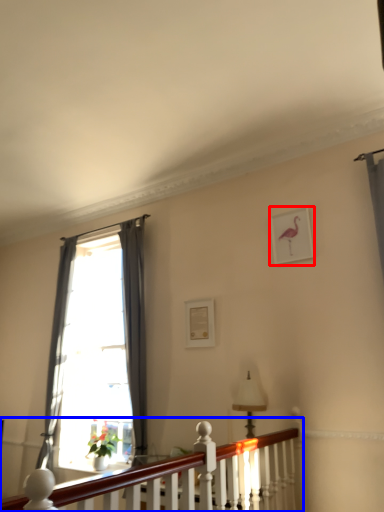
Question: Among these objects, which one is nearest to the camera, picture frame (highlighted by a red box) or balustrade (highlighted by a blue box)?

Choices:
 (A) picture frame
 (B) balustrade

Answer: (B)